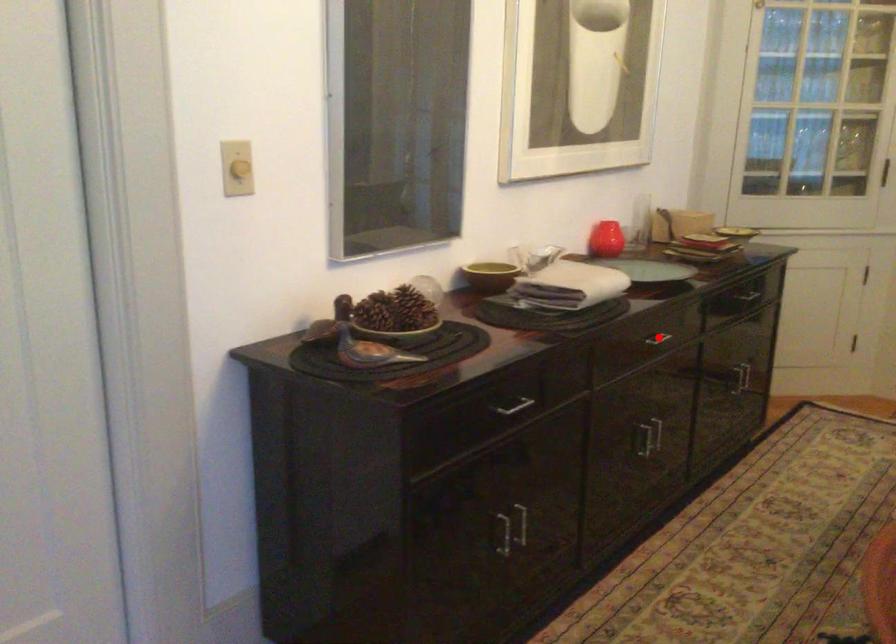
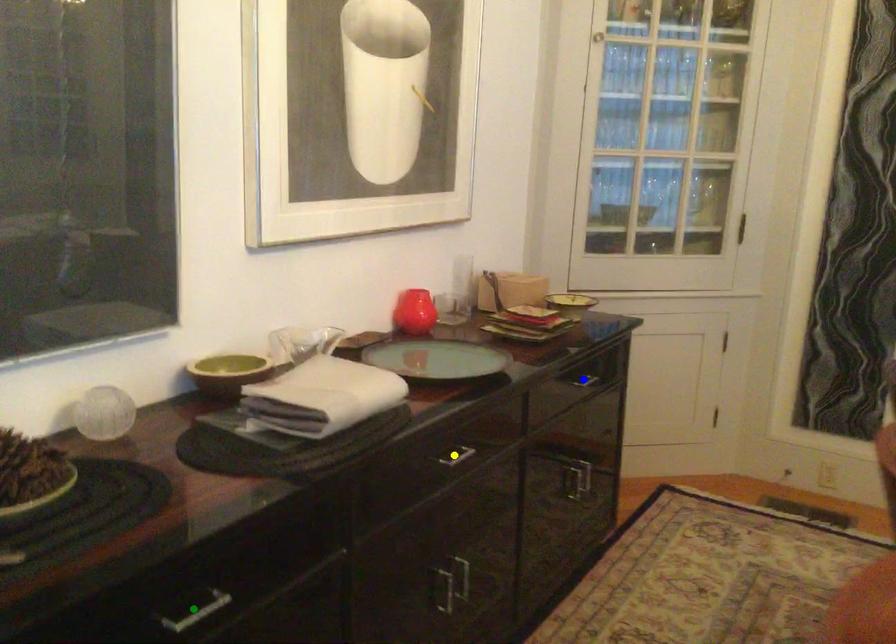
Question: I am providing you with two images of the same scene from different viewpoints. A red point is marked on the first image. You are given multiple points on the second image. Which point in image 2 is actually the same real-world point as the red point in image 1?

Choices:
 (A) green point
 (B) yellow point
 (C) blue point

Answer: (B)